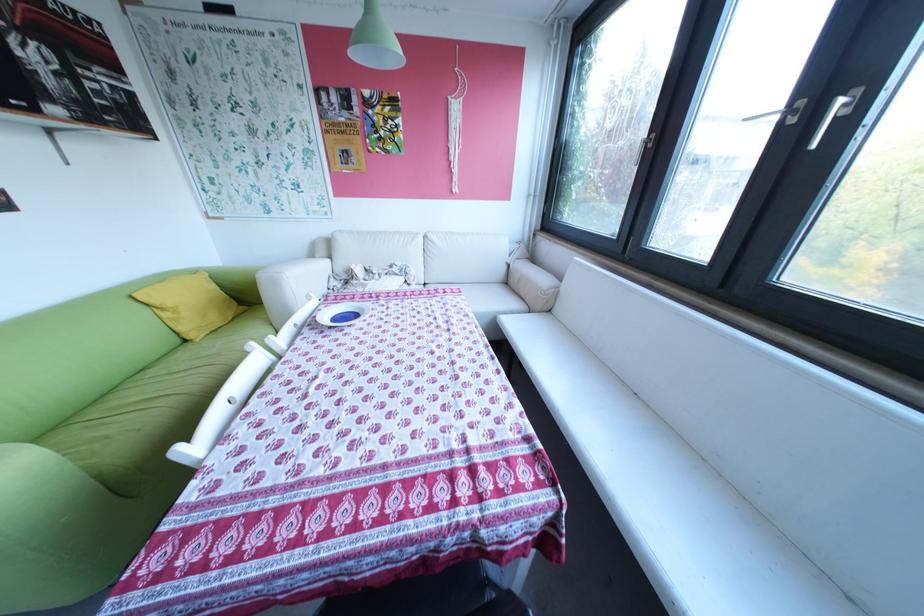
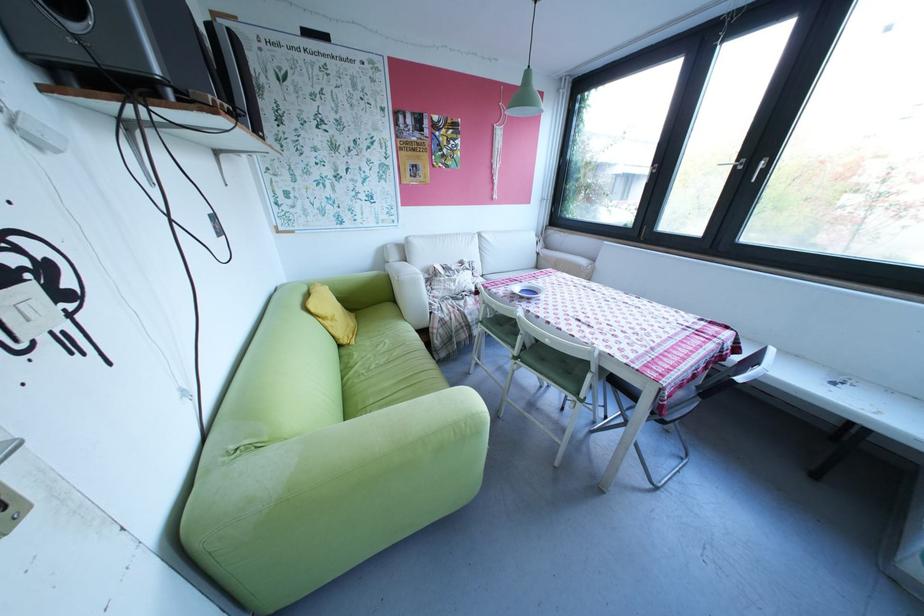
Locate, in the second image, the point that corresponds to point 177,314 in the first image.

(339, 323)